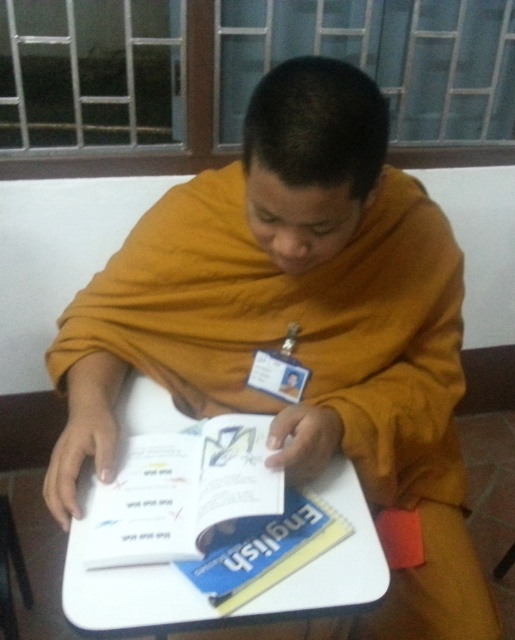
You are a delivery person who needs to place a small package on the white plastic table at center without touching the blue paper english book at center. Is there enough space between them to do this?

The white plastic table at center is only 4.32 inches away from the blue paper english book at center. Since the package is small, it might fit, but there is limited space between them. Careful placement is needed to avoid touching the book.

You are an interior designer planning to place a new lamp in the room where the white plastic table at center is located. The lamp needs to be placed at point coordinates of (123, 586). Can you confirm if the white plastic table at center is exactly at that point?

Yes, the white plastic table at center is located at point coordinates of (123, 586), so placing the lamp there would position it directly on the table.